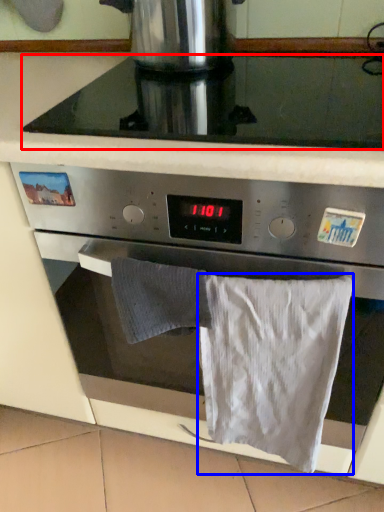
Question: Which point is closer to the camera, gas stove (highlighted by a red box) or bath towel (highlighted by a blue box)?

Choices:
 (A) gas stove
 (B) bath towel

Answer: (A)